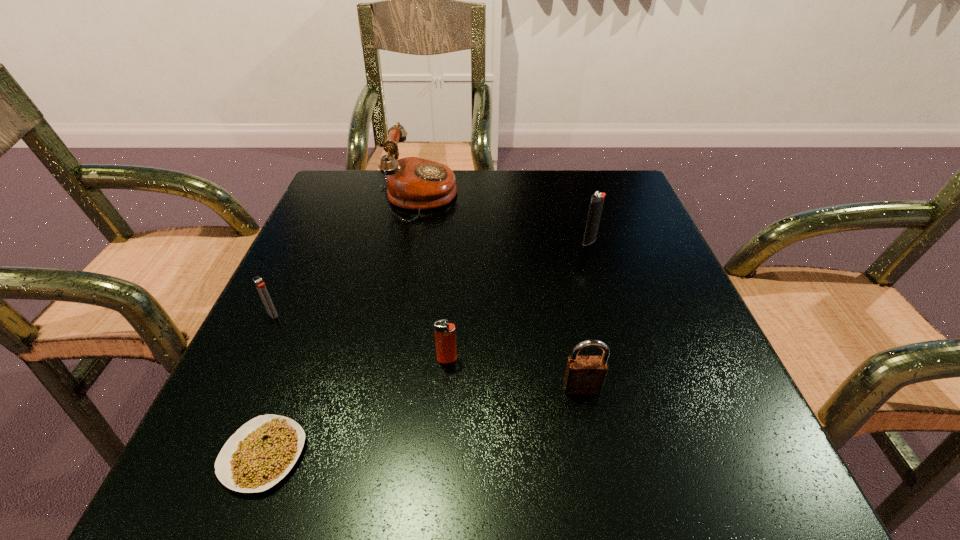
Find the location of `free location at the far right corner of the desktop`. free location at the far right corner of the desktop is located at coordinates (583, 172).

Locate an element on the screen. The image size is (960, 540). free space between the second object from left to right and the second object from right to left is located at coordinates (422, 422).

In order to click on empty space between the nearest object and the nearest igniter in this screenshot , I will do pyautogui.click(x=355, y=407).

Identify the location of free point between the nearest igniter and the second nearest object. The height and width of the screenshot is (540, 960). (515, 374).

Locate an element on the screen. This screenshot has height=540, width=960. vacant space that is in between the second object from left to right and the tallest igniter is located at coordinates (426, 348).

You are a GUI agent. You are given a task and a screenshot of the screen. Output one action in this format:
    pyautogui.click(x=<x>, y=<y>)
    Task: Click on the free point between the fifth nearest object and the second igniter from right to left
    
    Given the screenshot: What is the action you would take?
    pyautogui.click(x=518, y=300)

Image resolution: width=960 pixels, height=540 pixels. I want to click on free space between the tallest object and the shortest object, so click(343, 327).

You are a GUI agent. You are given a task and a screenshot of the screen. Output one action in this format:
    pyautogui.click(x=<x>, y=<y>)
    Task: Click on the free space between the shortest object and the tallest object
    This screenshot has height=540, width=960.
    Given the screenshot: What is the action you would take?
    pyautogui.click(x=343, y=327)

Where is `free space between the tallest object and the fifth farthest object`? free space between the tallest object and the fifth farthest object is located at coordinates (501, 293).

Locate an element on the screen. This screenshot has height=540, width=960. free spot between the second object from right to left and the third nearest object is located at coordinates (515, 374).